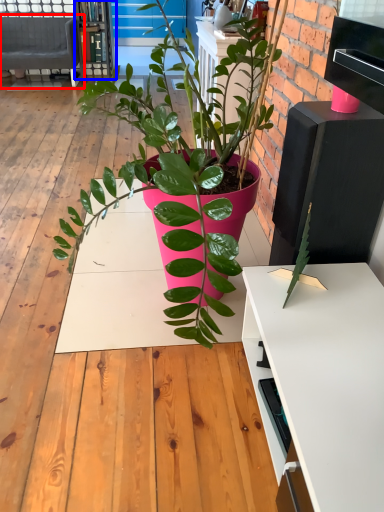
Question: Which object is closer to the camera taking this photo, studio couch (highlighted by a red box) or bookshelf (highlighted by a blue box)?

Choices:
 (A) studio couch
 (B) bookshelf

Answer: (A)